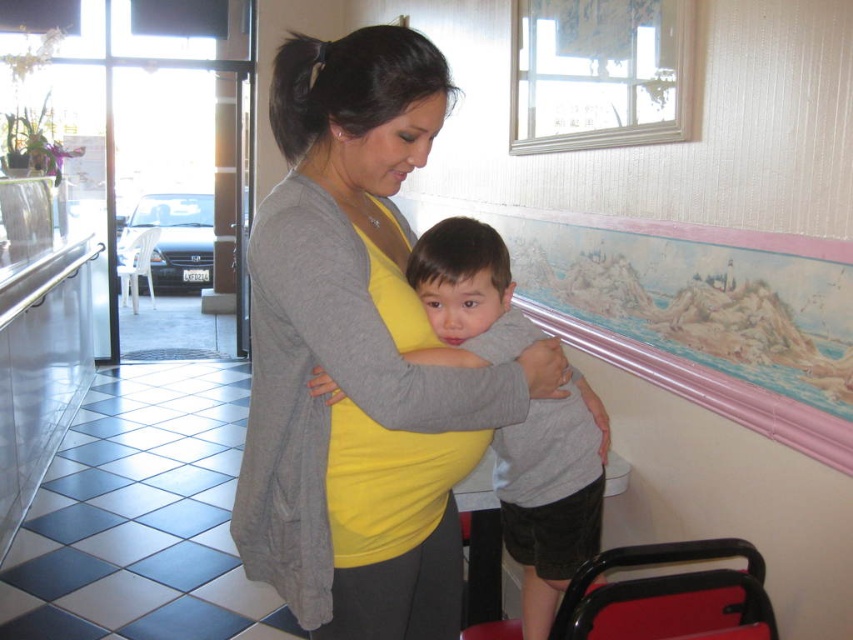
You are standing in the dining establishment and want to take a photo of the point at coordinates (325,180). Is this point within the camera frame if the camera has a focal length of 50mm and the sensor size is 24mm x 36mm?

The point at coordinates (325,180) is 3.42 feet away from the camera. To determine if it is within the frame, we can calculate the camera field of view. With a 50mm focal length and a 24mm sensor height, the vertical field of view is approximately 27 degrees. The distance to the point is 3.42 feet, so the maximum vertical coverage would be tan 13.5 degrees multiplied by 3.42 feet. This calculation shows the point is within the camera frame.

You are standing at the entrance of the dining establishment and want to reach the point marked as point (560, 417). However, there is an obstacle at point (334, 433). Can you walk directly to your destination without going around the obstacle?

Point (334, 433) is in front of point (560, 417), so you cannot walk directly to point (560, 417) without encountering the obstacle at point (334, 433) first. You will need to go around the obstacle.

You are a fashion designer observing the woman in the image. She is wearing a matte gray cardigan at center and a gray matte shirt at center. Which item of clothing is visible on top?

The matte gray cardigan at center is positioned over the gray matte shirt at center, so the cardigan is visible on top.